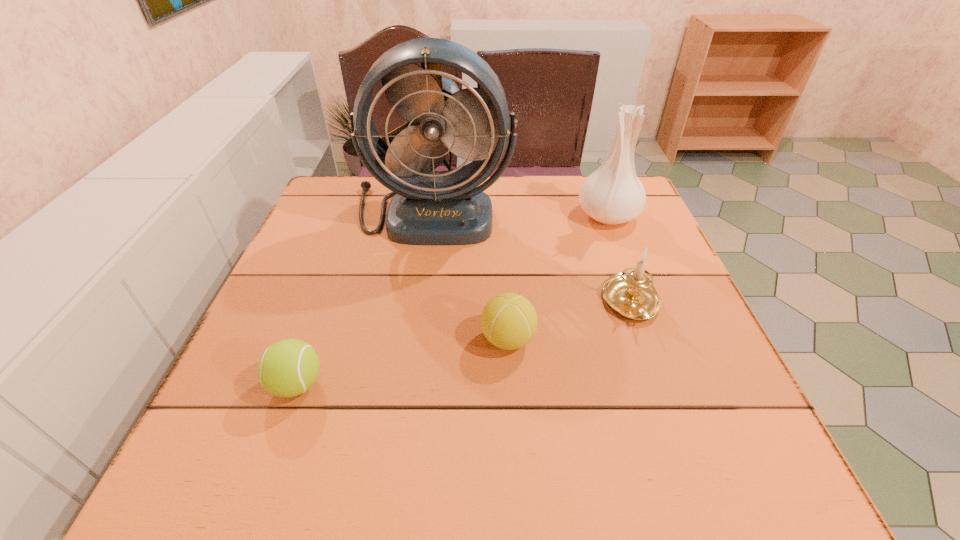
Locate an element on the screen. The image size is (960, 540). free space located 0.180m on the back of the left tennis ball is located at coordinates (330, 294).

At what (x,y) coordinates should I click in order to perform the action: click on fan present at the far edge. Please return your answer as a coordinate pair (x, y). Image resolution: width=960 pixels, height=540 pixels. Looking at the image, I should click on (429, 207).

You are a GUI agent. You are given a task and a screenshot of the screen. Output one action in this format:
    pyautogui.click(x=<x>, y=<y>)
    Task: Click on the vase that is at the far edge
    The image size is (960, 540).
    Given the screenshot: What is the action you would take?
    pyautogui.click(x=613, y=194)

Locate an element on the screen. The image size is (960, 540). fan located at the left edge is located at coordinates (429, 207).

Find the location of a particular element. tennis ball that is positioned at the left edge is located at coordinates (289, 367).

Locate an element on the screen. This screenshot has height=540, width=960. vase that is at the right edge is located at coordinates (613, 194).

The height and width of the screenshot is (540, 960). I want to click on candle holder located at the right edge, so click(x=630, y=293).

I want to click on object present at the far left corner, so click(429, 207).

Where is `object at the far right corner`? object at the far right corner is located at coordinates (613, 194).

I want to click on vacant space at the far edge of the desktop, so click(570, 179).